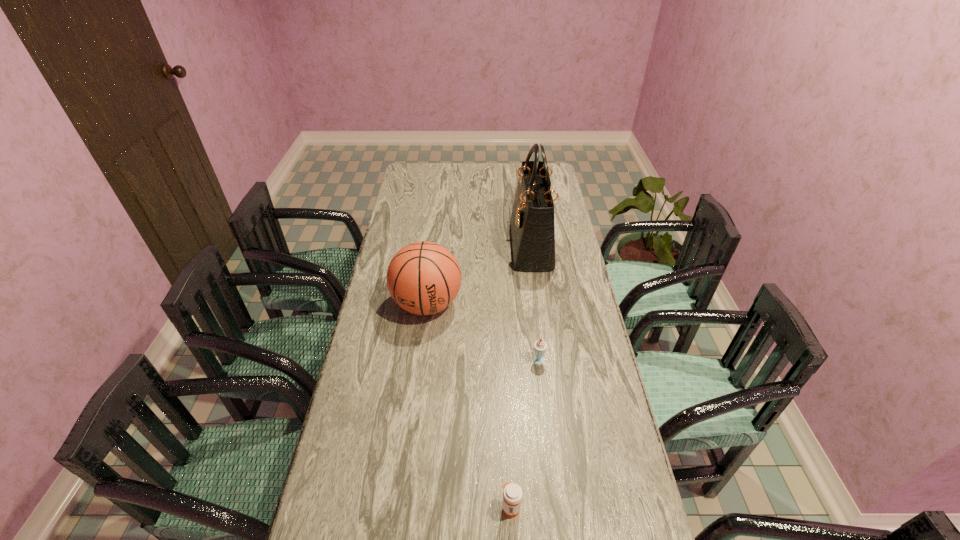
The height and width of the screenshot is (540, 960). I want to click on free spot located 0.290m on the surface of the second farthest object near the brand logo, so click(415, 406).

The width and height of the screenshot is (960, 540). Find the location of `vacant area situated on the straw side of the third farthest object`. vacant area situated on the straw side of the third farthest object is located at coordinates (556, 481).

Find the location of `vacant space located on the back of the second object from left to right`. vacant space located on the back of the second object from left to right is located at coordinates (504, 373).

You are a GUI agent. You are given a task and a screenshot of the screen. Output one action in this format:
    pyautogui.click(x=<x>, y=<y>)
    Task: Click on the object that is at the left edge
    
    Given the screenshot: What is the action you would take?
    pyautogui.click(x=423, y=278)

The width and height of the screenshot is (960, 540). I want to click on object that is at the right edge, so click(532, 220).

Find the location of a particular element. The image size is (960, 540). vacant region at the far edge of the desktop is located at coordinates (444, 178).

In the image, there is a desktop. Where is `free space at the left edge`? free space at the left edge is located at coordinates (372, 312).

Where is `vacant position at the right edge of the desktop`? This screenshot has height=540, width=960. vacant position at the right edge of the desktop is located at coordinates (570, 224).

I want to click on free space between the farthest object and the basketball, so click(x=479, y=275).

Find the location of a particular element. The width and height of the screenshot is (960, 540). vacant space in between the tallest object and the shortest object is located at coordinates (521, 377).